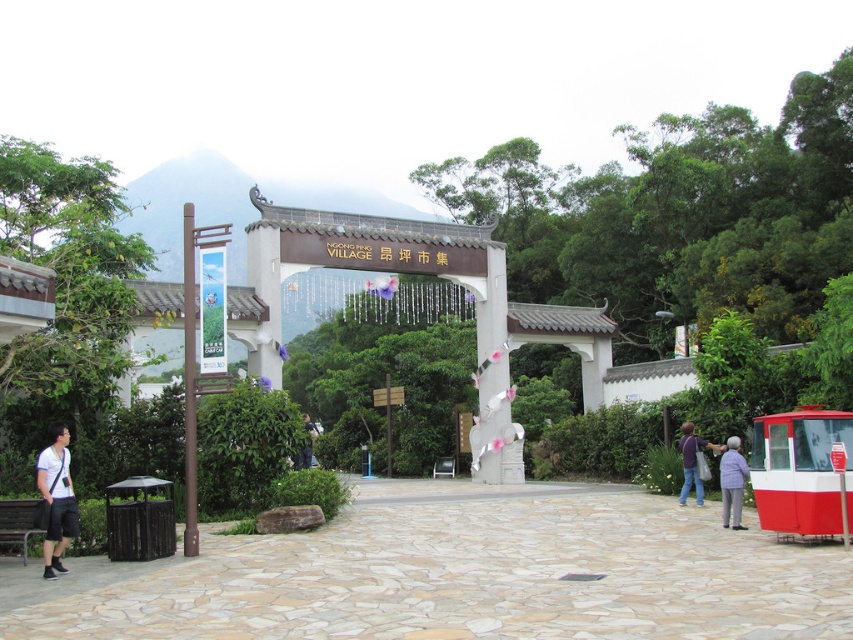
Question: Can you confirm if white matte shirt at left is positioned below dark blue jeans at lower right?

Choices:
 (A) no
 (B) yes

Answer: (A)

Question: Which object appears closest to the camera in this image?

Choices:
 (A) dark blue jeans at lower right
 (B) white matte shirt at left
 (C) gray fabric jacket at lower right
 (D) blue denim jeans at center

Answer: (B)

Question: Which is nearer to the blue denim jeans at center?

Choices:
 (A) white matte shirt at left
 (B) dark blue jeans at lower right
 (C) gray fabric jacket at lower right

Answer: (A)

Question: Which object is the farthest from the white matte shirt at left?

Choices:
 (A) dark blue jeans at lower right
 (B) blue denim jeans at center

Answer: (A)

Question: Can you confirm if gray fabric jacket at lower right is wider than dark blue jeans at lower right?

Choices:
 (A) no
 (B) yes

Answer: (B)

Question: Is white matte shirt at left smaller than dark blue jeans at lower right?

Choices:
 (A) yes
 (B) no

Answer: (B)